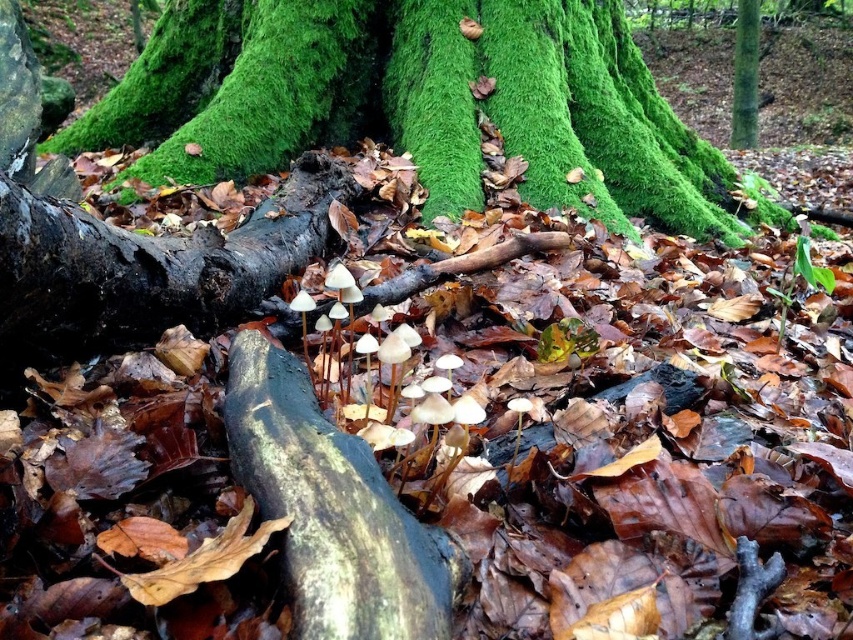
You are a hiker who wants to take a photo of both the green mossy tree trunk at center and the green smooth tree trunk at upper right. Since you have a wide angle lens, which tree trunk should you focus on to ensure both are in frame?

The green mossy tree trunk at center is larger in size compared to the green smooth tree trunk at upper right. To ensure both are in frame, focus on the green mossy tree trunk at center since it occupies more space and will help frame the smaller one within the shot.

A hiker is standing at point (231, 20) and wants to reach a water source located at point 0.272, 0.033. The hiker has a rope that is 3 meters long. Can the hiker safely cross the distance using the rope?

The distance between point (231, 20) and point 0.272, 0.033 is 3.37 meters. Since the rope is only 3 meters long, it is not long enough to safely cross the distance. The hiker would need a longer rope or an alternative path.